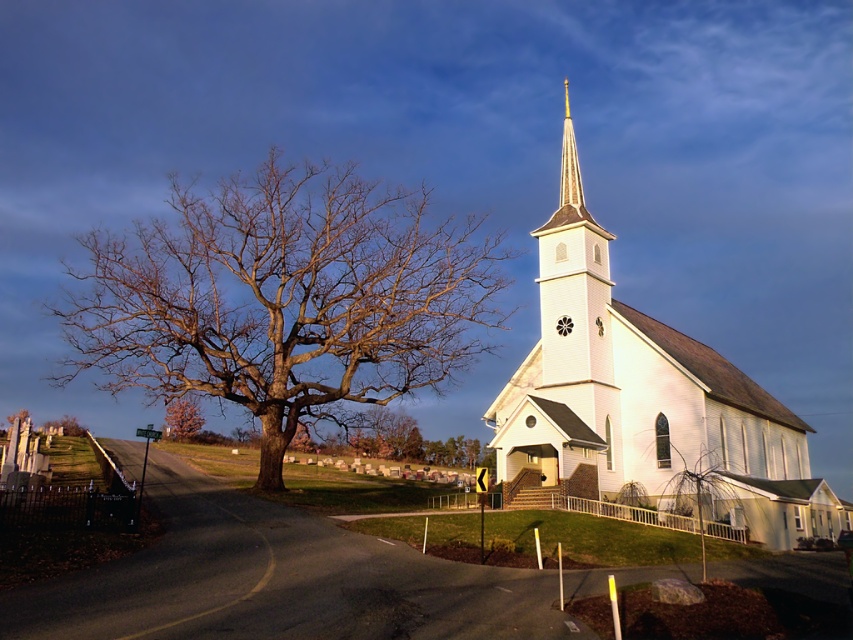
Is shiny gold spire at upper center wider than pink textured tree at lower left?

Yes, shiny gold spire at upper center is wider than pink textured tree at lower left.

Is point (573, 147) less distant than point (172, 413)?

Yes, it is.

Image resolution: width=853 pixels, height=640 pixels. Find the location of `shiny gold spire at upper center`. shiny gold spire at upper center is located at coordinates (569, 164).

Looking at this image, who is shorter, bare wood tree at left or shiny gold spire at upper center?

Standing shorter between the two is shiny gold spire at upper center.

Where is `bare wood tree at left`? The image size is (853, 640). bare wood tree at left is located at coordinates (285, 298).

I want to click on bare wood tree at left, so coord(285,298).

Which is above, white wood church at center or pink textured tree at lower left?

white wood church at center is higher up.

Can you confirm if white wood church at center is wider than pink textured tree at lower left?

Indeed, white wood church at center has a greater width compared to pink textured tree at lower left.

Between point (805, 458) and point (190, 422), which one is positioned in front?

Point (805, 458)

This screenshot has width=853, height=640. In order to click on white wood church at center in this screenshot , I will do `click(648, 406)`.